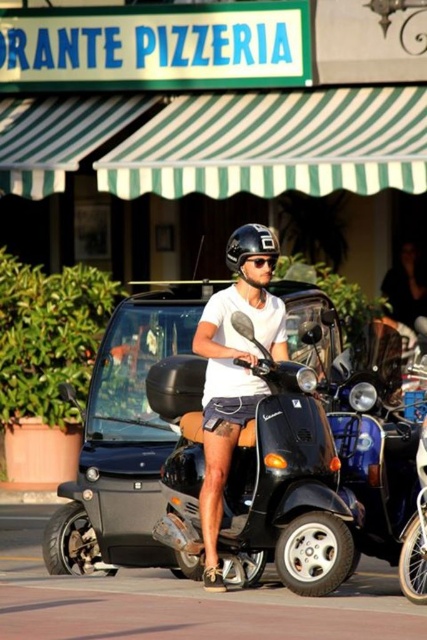
Question: Which point is farther to the camera?

Choices:
 (A) black matte helmet at center
 (B) matte white helmet at center
 (C) black matte scooter at center

Answer: (A)

Question: Considering the real-world distances, which object is closest to the black matte scooter at center?

Choices:
 (A) shiny black scooter at center
 (B) matte white helmet at center

Answer: (B)

Question: Which of the following is the closest to the observer?

Choices:
 (A) black matte scooter at center
 (B) matte white helmet at center
 (C) shiny black scooter at center

Answer: (B)

Question: Does black matte scooter at center have a smaller size compared to shiny black scooter at center?

Choices:
 (A) no
 (B) yes

Answer: (B)

Question: Is shiny black scooter at center thinner than matte white helmet at center?

Choices:
 (A) no
 (B) yes

Answer: (A)

Question: Can you confirm if black matte scooter at center is smaller than shiny black scooter at center?

Choices:
 (A) yes
 (B) no

Answer: (A)